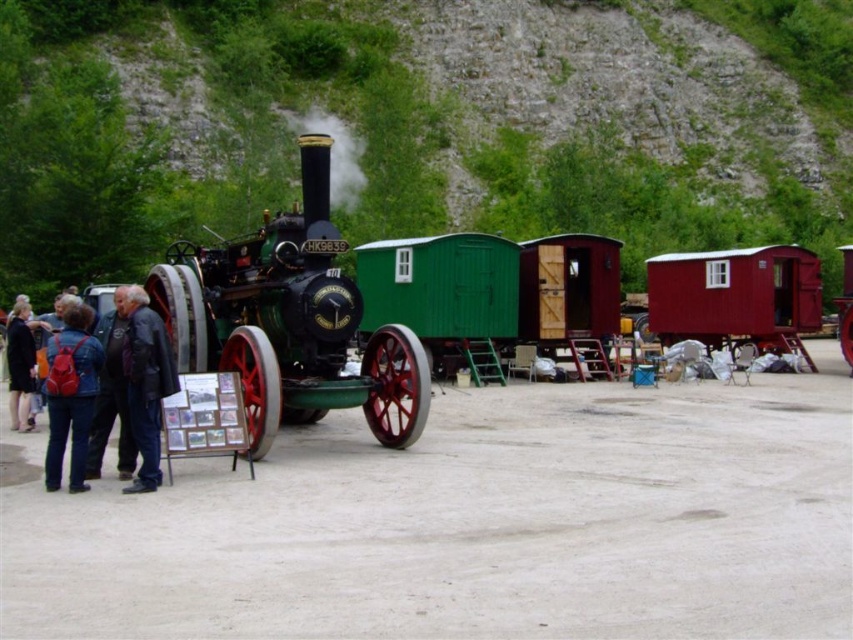
Question: Does smooth wooden cabin at right appear on the right side of black leather jacket at lower left?

Choices:
 (A) no
 (B) yes

Answer: (B)

Question: Which point appears farthest from the camera in this image?

Choices:
 (A) (683, 317)
 (B) (144, 456)
 (C) (15, 376)

Answer: (A)

Question: Which of these objects is positioned farthest from the black leather jacket at lower left?

Choices:
 (A) red backpack at lower left
 (B) smooth wooden cabin at right
 (C) dark blue jacket at lower left

Answer: (B)

Question: Which object is positioned closest to the black leather jacket at lower left?

Choices:
 (A) red backpack at lower left
 (B) smooth wooden cabin at right
 (C) dark blue jacket at lower left

Answer: (A)

Question: Considering the relative positions of smooth wooden cabin at right and black leather jacket at lower left in the image provided, where is smooth wooden cabin at right located with respect to black leather jacket at lower left?

Choices:
 (A) right
 (B) left

Answer: (A)

Question: Can you confirm if smooth wooden cabin at right is smaller than black leather jacket at lower left?

Choices:
 (A) yes
 (B) no

Answer: (B)